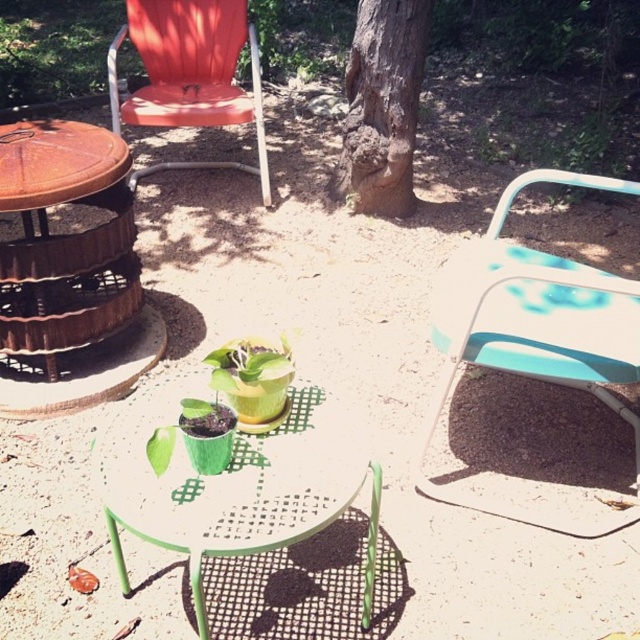
You are planning to place a 24 inch wide decorative item between the orange plastic chair at upper left and the brown rough bark tree at center. Is there enough space for it?

The orange plastic chair at upper left is 26.21 inches from the brown rough bark tree at center. Since the decorative item is 24 inches wide, there is enough space between them to place it.

You are setting up a small outdoor event and need to place two chairs. You have a teal plastic folding chair at upper right and an orange plastic chair at upper left. Which chair has a smaller width?

The teal plastic folding chair at upper right has a smaller width than the orange plastic chair at upper left.

You are planning to place a new rectangular plant pot on the patio. The existing green matte plant pot at center is wider than the brown rough bark tree at center. If your new pot is narrower than the tree, will it fit between them?

The green matte plant pot at center is wider than the brown rough bark tree at center. Since your new pot is narrower than the tree, it will also be narrower than the plant pot. Therefore, it should fit between them as there will be enough space.